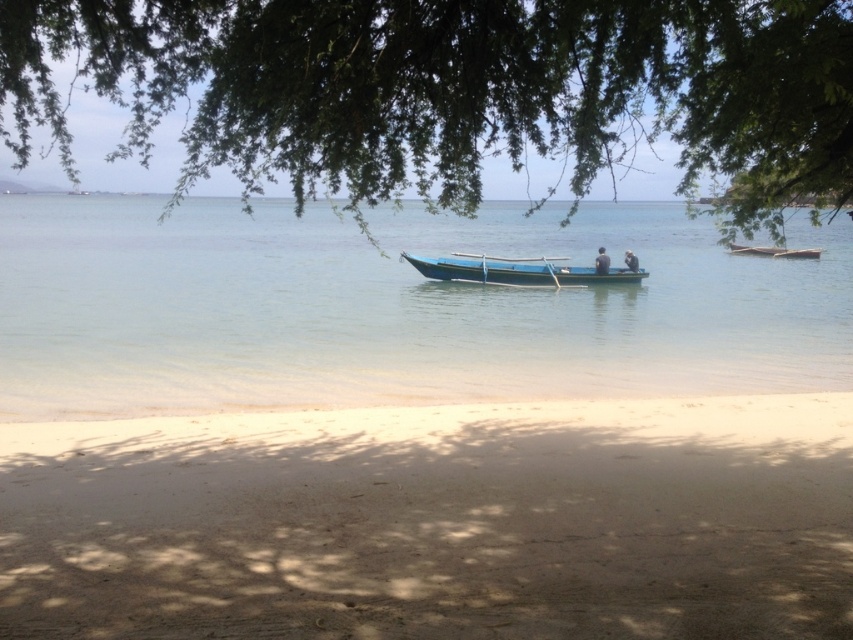
You are standing on the beach and want to take a photo of the blue wooden boat at center. If your camera has a maximum zoom range of 20 meters, will you be able to capture the boat clearly without moving closer?

The blue wooden boat at center and the camera are 21.85 meters apart, which exceeds the camera maximum zoom range of 20 meters. Therefore, you won not be able to capture the boat clearly without moving closer.

From the picture: You are standing on the sandy beach and want to reach the blue wooden boat at center. Which direction should you walk to get there?

The blue wooden boat at center is located at point 0.423 on the x and 0.606 on the y axis, so you should walk towards the center of the image to reach it.

You are standing on the beach and want to shade yourself using the green leafy tree at upper center. Can the tree provide enough shade to cover the smooth skin person at center?

The green leafy tree at upper center is taller than the smooth skin person at center, so it can provide shade over them.